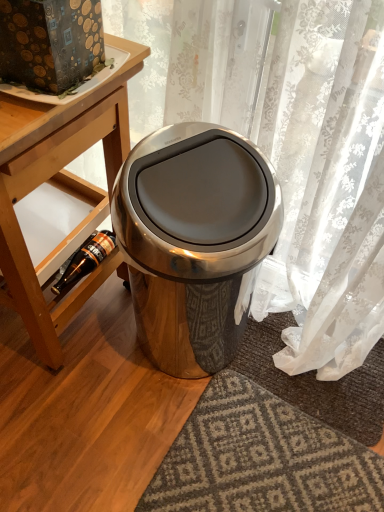
Identify the location of free location to the right of satin metallic trash can at center. The height and width of the screenshot is (512, 384). (282, 386).